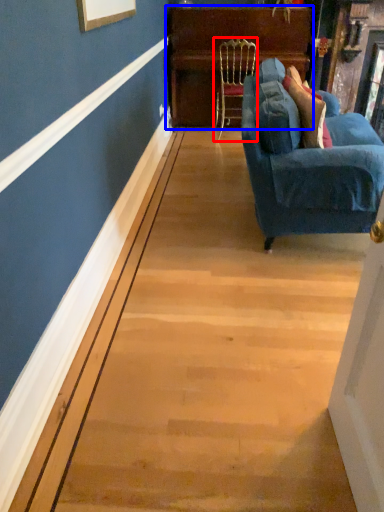
Question: Among these objects, which one is nearest to the camera, chair (highlighted by a red box) or dresser (highlighted by a blue box)?

Choices:
 (A) chair
 (B) dresser

Answer: (A)